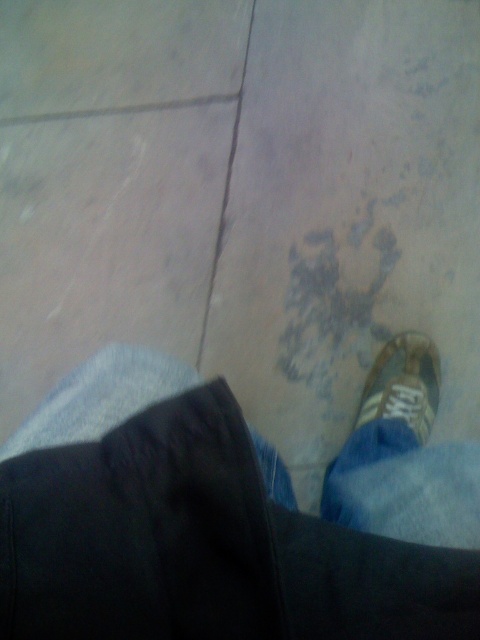
Question: Is the position of denim pants at lower center less distant than that of suede-like brown shoe at lower right?

Choices:
 (A) no
 (B) yes

Answer: (B)

Question: Which of the following is the farthest from the observer?

Choices:
 (A) denim pants at lower center
 (B) suede-like brown shoe at lower right

Answer: (B)

Question: Is denim pants at lower center further to camera compared to suede-like brown shoe at lower right?

Choices:
 (A) no
 (B) yes

Answer: (A)

Question: Is denim pants at lower center thinner than suede-like brown shoe at lower right?

Choices:
 (A) yes
 (B) no

Answer: (B)